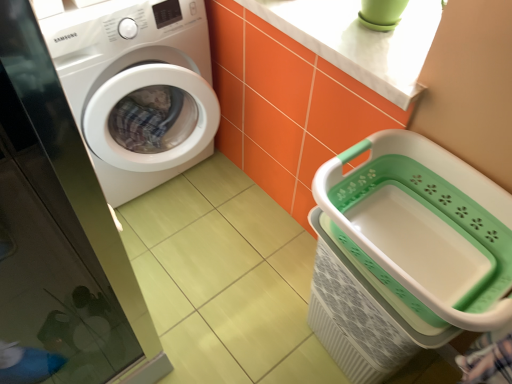
Question: From the image's perspective, does transparent glass screen door at left appear higher than white marble countertop at upper center?

Choices:
 (A) no
 (B) yes

Answer: (A)

Question: Is the depth of transparent glass screen door at left greater than that of white marble countertop at upper center?

Choices:
 (A) yes
 (B) no

Answer: (B)

Question: Is transparent glass screen door at left wider than white marble countertop at upper center?

Choices:
 (A) yes
 (B) no

Answer: (B)

Question: Is transparent glass screen door at left oriented towards white marble countertop at upper center?

Choices:
 (A) no
 (B) yes

Answer: (A)

Question: Does transparent glass screen door at left have a greater height compared to white marble countertop at upper center?

Choices:
 (A) no
 (B) yes

Answer: (B)

Question: From a real-world perspective, relative to white plastic laundry basket at lower right, is white glossy washing machine at left vertically above or below?

Choices:
 (A) above
 (B) below

Answer: (B)

Question: Is white glossy washing machine at left wider or thinner than white plastic laundry basket at lower right?

Choices:
 (A) thin
 (B) wide

Answer: (B)

Question: In terms of size, does white glossy washing machine at left appear bigger or smaller than white plastic laundry basket at lower right?

Choices:
 (A) small
 (B) big

Answer: (B)

Question: Would you say white glossy washing machine at left is to the left or to the right of white plastic laundry basket at lower right in the picture?

Choices:
 (A) right
 (B) left

Answer: (B)

Question: From a real-world perspective, relative to transparent glass screen door at left, is white glossy washing machine at left vertically above or below?

Choices:
 (A) below
 (B) above

Answer: (A)

Question: Looking at their shapes, would you say white glossy washing machine at left is wider or thinner than transparent glass screen door at left?

Choices:
 (A) thin
 (B) wide

Answer: (B)

Question: From the image's perspective, is white glossy washing machine at left located above or below transparent glass screen door at left?

Choices:
 (A) above
 (B) below

Answer: (A)

Question: Does point (96, 147) appear closer or farther from the camera than point (77, 273)?

Choices:
 (A) closer
 (B) farther

Answer: (A)

Question: Considering the positions of transparent glass screen door at left and white glossy washing machine at left in the image, is transparent glass screen door at left bigger or smaller than white glossy washing machine at left?

Choices:
 (A) small
 (B) big

Answer: (A)

Question: From a real-world perspective, is transparent glass screen door at left physically located above or below white glossy washing machine at left?

Choices:
 (A) below
 (B) above

Answer: (B)